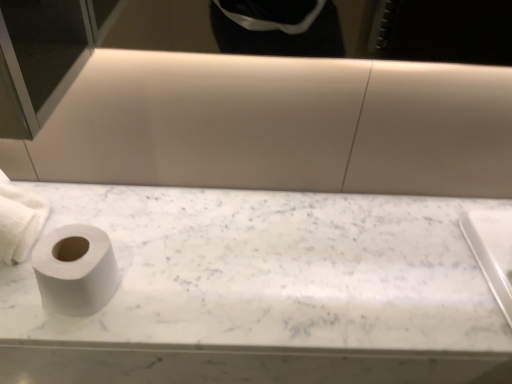
Question: Would you say white matte toilet paper at left, which appears as the 1th toilet paper when viewed from the right, is to the left or to the right of white matte toilet paper at left, the second toilet paper from the right, in the picture?

Choices:
 (A) right
 (B) left

Answer: (A)

Question: Is point (57, 276) positioned closer to the camera than point (14, 208)?

Choices:
 (A) farther
 (B) closer

Answer: (B)

Question: Which object is the farthest from the white matte toilet paper at left, the second toilet paper in the left-to-right sequence?

Choices:
 (A) white marble toilet paper at left
 (B) white matte toilet paper at left, the second toilet paper from the right

Answer: (A)

Question: Based on their relative distances, which object is nearer to the white matte toilet paper at left, which appears as the 1th toilet paper when viewed from the right?

Choices:
 (A) white marble toilet paper at left
 (B) white matte toilet paper at left, the second toilet paper from the right

Answer: (B)